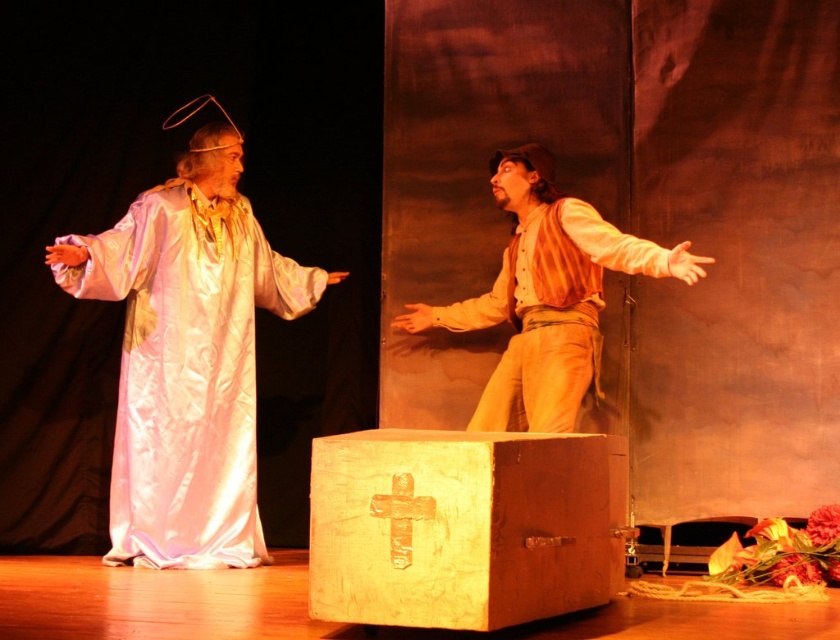
Who is positioned more to the right, silky white robe at left or wooden box with cross at center?

Positioned to the right is wooden box with cross at center.

Locate an element on the screen. The height and width of the screenshot is (640, 840). silky white robe at left is located at coordinates (187, 356).

This screenshot has width=840, height=640. What are the coordinates of `silky white robe at left` in the screenshot? It's located at (187, 356).

Is silky white robe at left bigger than matte brown shirt at center?

Yes.

Describe the element at coordinates (187, 356) in the screenshot. I see `silky white robe at left` at that location.

Is point (295, 314) less distant than point (578, 269)?

That is False.

This screenshot has width=840, height=640. I want to click on silky white robe at left, so click(x=187, y=356).

Does wooden box with cross at center appear over matte brown shirt at center?

Incorrect, wooden box with cross at center is not positioned above matte brown shirt at center.

Can you confirm if wooden box with cross at center is positioned to the right of matte brown shirt at center?

In fact, wooden box with cross at center is to the left of matte brown shirt at center.

Looking at this image, who is more forward, (332, 516) or (559, 316)?

Point (332, 516)

Find the location of `wooden box with cross at center`. wooden box with cross at center is located at coordinates (458, 528).